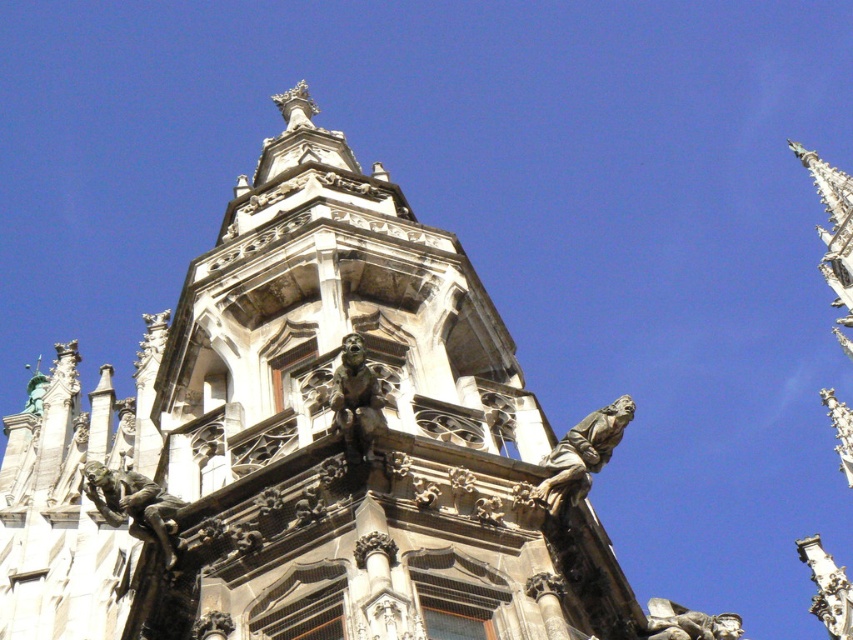
You are an art conservator assessing the architectural details of the scene. You need to determine which of the two statues, the polished bronze gargoyle at lower left or the green patina statue at upper left, requires more immediate attention due to its size. Which one should you prioritize?

The green patina statue at upper left should be prioritized because it is larger than the polished bronze gargoyle at lower left, making it potentially more vulnerable to structural issues or environmental damage.

You are an architect examining the structure and want to determine which of the two points, point [97,464] or point [39,412], is nearer to your viewpoint. Based on the scene details, which point is closer?

Point [97,464] is closer to the camera than point [39,412], so it is the nearer point from your viewpoint.